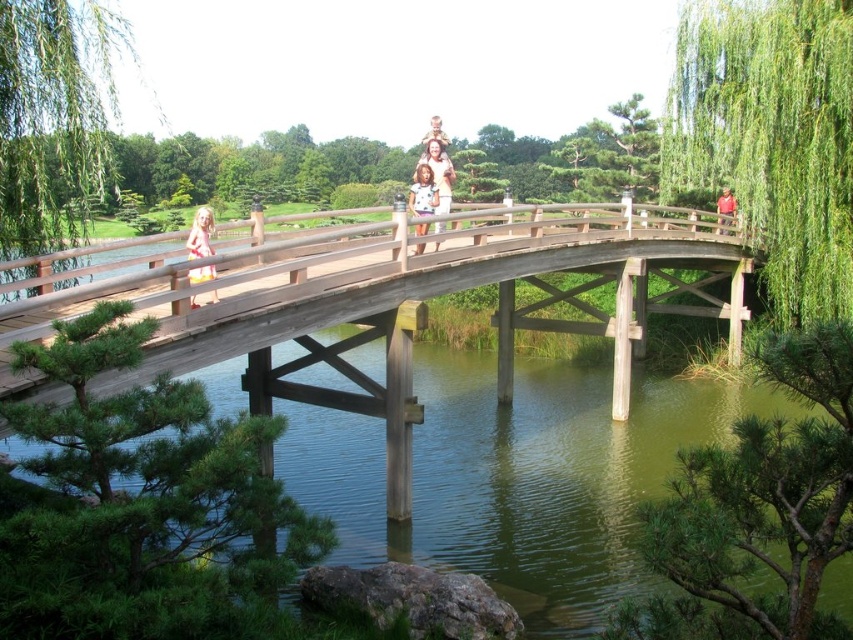
Question: Does light brown wooden bridge at center have a smaller size compared to matte purple dress at center?

Choices:
 (A) yes
 (B) no

Answer: (B)

Question: Is matte purple dress at center below red cotton shirt at upper center?

Choices:
 (A) no
 (B) yes

Answer: (B)

Question: Is the position of matte pink dress at left less distant than that of red cotton shirt at upper center?

Choices:
 (A) yes
 (B) no

Answer: (A)

Question: Estimate the real-world distances between objects in this image. Which object is closer to the matte purple dress at center?

Choices:
 (A) green liquid water at bridge center
 (B) red cotton shirt at upper center
 (C) wooden bridge at center
 (D) light brown wooden bridge at center

Answer: (D)

Question: Among these objects, which one is nearest to the camera?

Choices:
 (A) green liquid water at bridge center
 (B) light brown wooden bridge at center
 (C) matte pink dress at left
 (D) matte purple dress at center

Answer: (A)

Question: Which object appears closest to the camera in this image?

Choices:
 (A) red cotton shirt at upper center
 (B) matte purple dress at center
 (C) green liquid water at bridge center

Answer: (C)